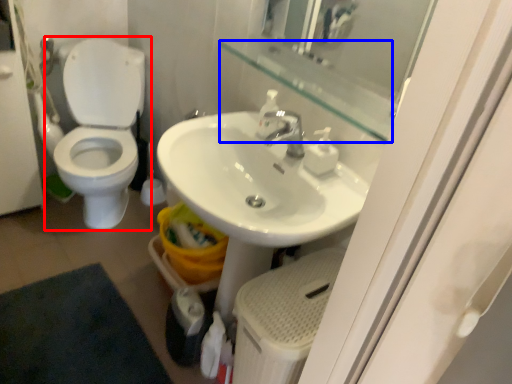
Question: Which point is closer to the camera, toilet (highlighted by a red box) or balustrade (highlighted by a blue box)?

Choices:
 (A) toilet
 (B) balustrade

Answer: (B)